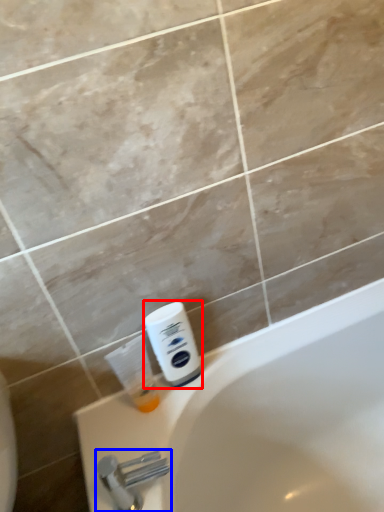
Question: Which of the following is the closest to the observer, shaving cream (highlighted by a red box) or tap (highlighted by a blue box)?

Choices:
 (A) shaving cream
 (B) tap

Answer: (B)